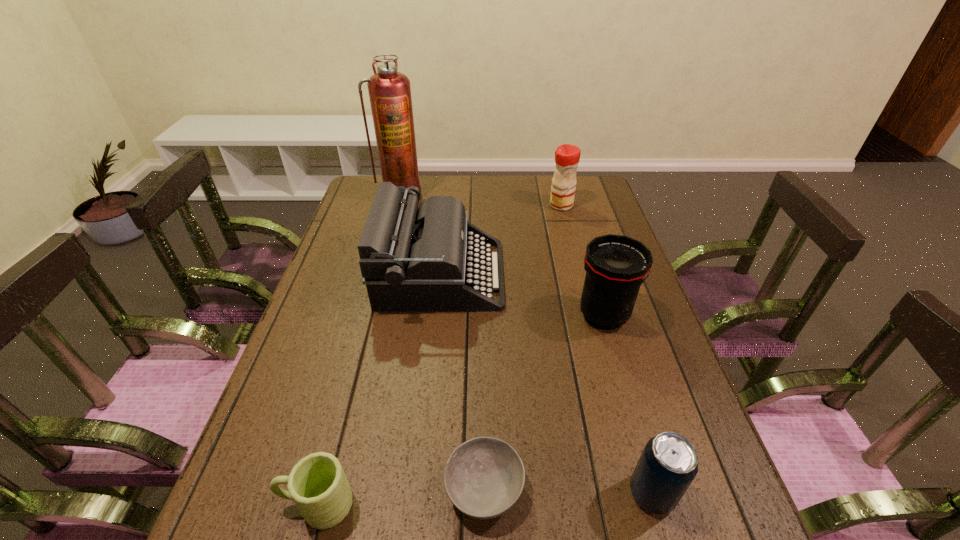
I want to click on vacant space located 0.380m on the front of the telephoto lens, so click(x=655, y=491).

At what (x,y) coordinates should I click in order to perform the action: click on vacant region located 0.360m on the left of the fifth tallest object. Please return your answer as a coordinate pair (x, y). Looking at the image, I should click on (437, 493).

The width and height of the screenshot is (960, 540). I want to click on vacant position located on the left of the shortest object, so click(297, 488).

The image size is (960, 540). In order to click on fire extinguisher that is positioned at the far edge in this screenshot , I will do `click(389, 91)`.

Image resolution: width=960 pixels, height=540 pixels. Identify the location of condiment at the far edge. (567, 157).

The image size is (960, 540). Find the location of `fire extinguisher present at the left edge`. fire extinguisher present at the left edge is located at coordinates (389, 91).

Find the location of a particular element. The width and height of the screenshot is (960, 540). mug that is positioned at the left edge is located at coordinates (317, 484).

Where is `condiment that is at the right edge`? The width and height of the screenshot is (960, 540). condiment that is at the right edge is located at coordinates (567, 157).

Locate an element on the screen. The height and width of the screenshot is (540, 960). telephoto lens at the right edge is located at coordinates (616, 266).

The height and width of the screenshot is (540, 960). In order to click on soda can located at the right edge in this screenshot , I will do `click(668, 464)`.